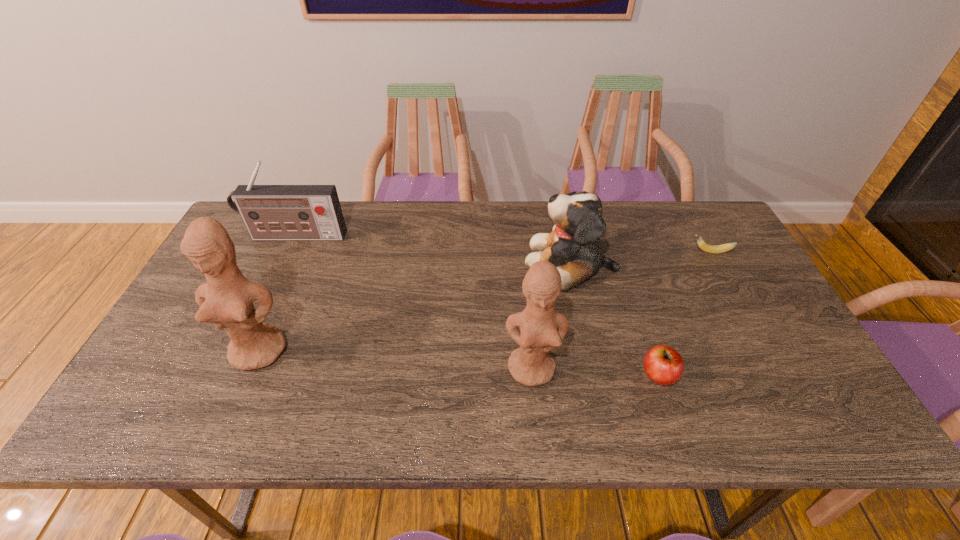
This screenshot has width=960, height=540. In order to click on vacant region located 0.370m at the stem of the rightmost object in this screenshot , I will do `click(566, 252)`.

Find the location of a particular element. The image size is (960, 540). free point located 0.220m at the stem of the rightmost object is located at coordinates (615, 252).

Identify the location of free spot located 0.390m at the stem of the rightmost object. The image size is (960, 540). (560, 252).

Image resolution: width=960 pixels, height=540 pixels. What are the coordinates of `vacant space situated at the face of the third shortest object` in the screenshot? It's located at (403, 262).

You are a GUI agent. You are given a task and a screenshot of the screen. Output one action in this format:
    pyautogui.click(x=<x>, y=<y>)
    Task: Click on the vacant region located at the face of the third shortest object
    Image resolution: width=960 pixels, height=540 pixels.
    Given the screenshot: What is the action you would take?
    pyautogui.click(x=426, y=262)

Locate an element on the screen. Image resolution: width=960 pixels, height=540 pixels. free region located at the face of the third shortest object is located at coordinates (501, 262).

At what (x,y) coordinates should I click in order to perform the action: click on free region located on the right of the second shortest object. Please return your answer as a coordinate pair (x, y). Image resolution: width=960 pixels, height=540 pixels. Looking at the image, I should click on (732, 375).

I want to click on radio receiver positioned at the far edge, so click(270, 212).

I want to click on puppy situated at the far edge, so click(572, 246).

Locate an element on the screen. apple present at the near edge is located at coordinates (663, 365).